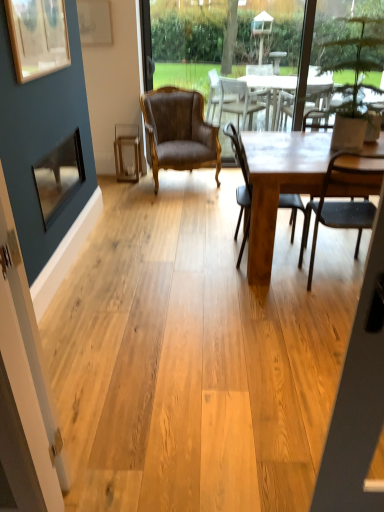
This screenshot has height=512, width=384. In order to click on vacant space in between matte brown chair at center, placed as the 2th chair when sorted from front to back, and wooden table at center in this screenshot , I will do `click(228, 260)`.